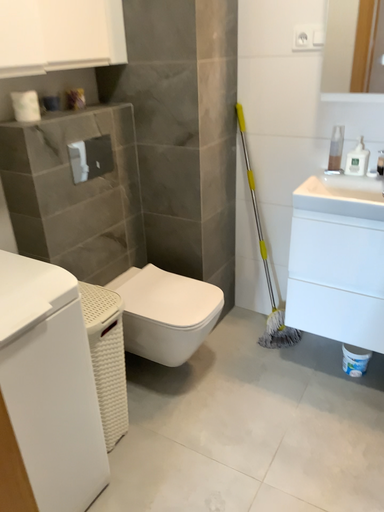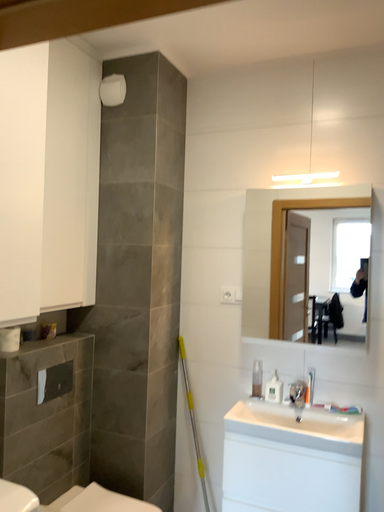
Question: Which way did the camera rotate in the video?

Choices:
 (A) rotated downward
 (B) rotated upward

Answer: (B)